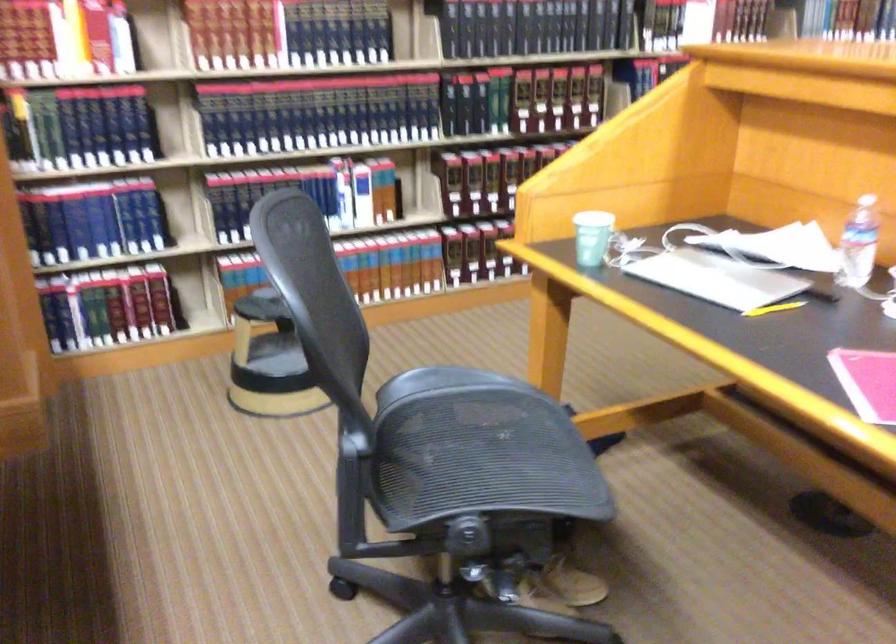
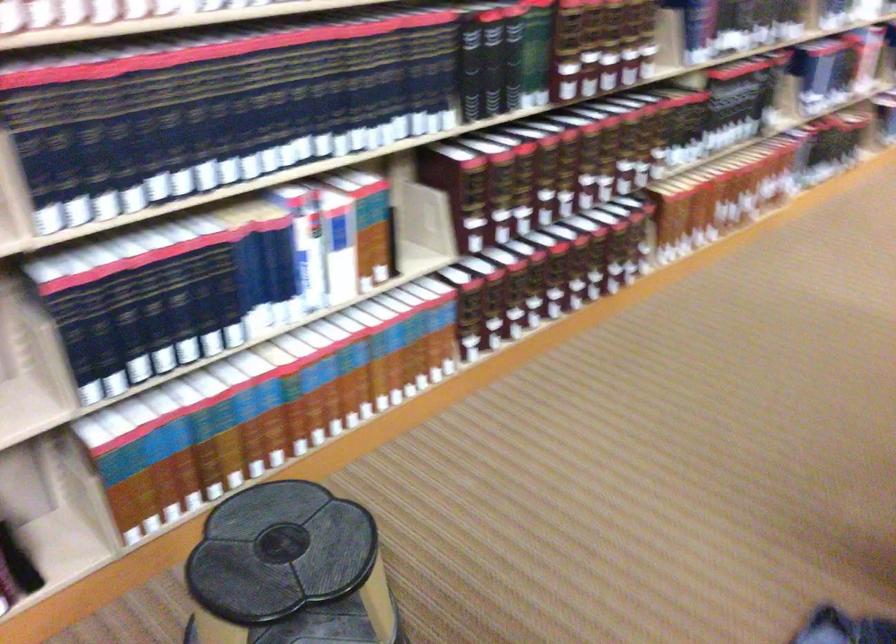
In the second image, find the point that corresponds to point (424, 198) in the first image.

(421, 228)